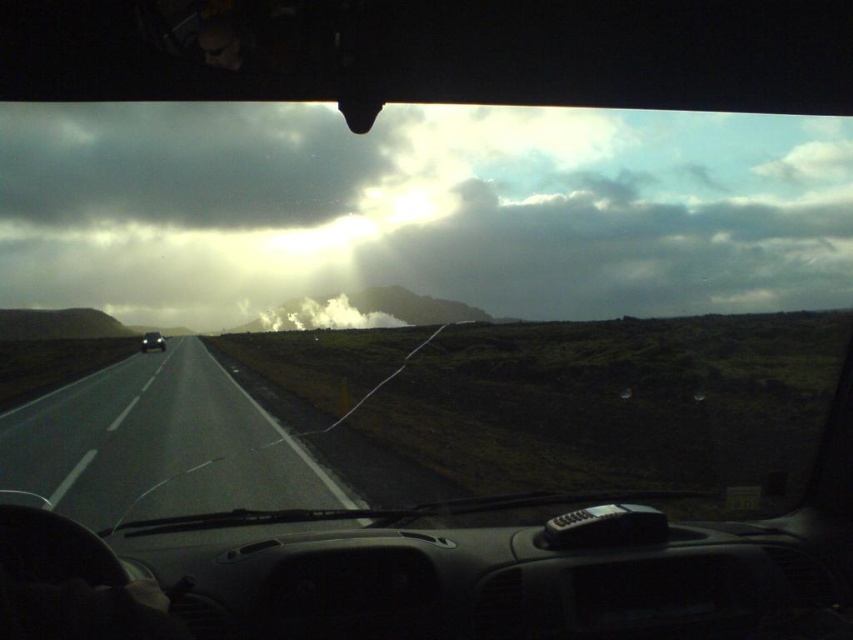
Question: Can you confirm if asphalt road at center is bigger than shiny black car at center?

Choices:
 (A) no
 (B) yes

Answer: (A)

Question: Which object is farther from the camera taking this photo?

Choices:
 (A) cloudy sky at upper center
 (B) shiny black car at center

Answer: (B)

Question: Is cloudy sky at upper center to the left of asphalt road at center from the viewer's perspective?

Choices:
 (A) no
 (B) yes

Answer: (A)

Question: Which point is farther from the camera taking this photo?

Choices:
 (A) (160, 339)
 (B) (190, 458)
 (C) (210, 168)

Answer: (C)

Question: Which is nearer to the cloudy sky at upper center?

Choices:
 (A) asphalt road at center
 (B) shiny black car at center

Answer: (B)

Question: Does asphalt road at center appear under shiny black car at center?

Choices:
 (A) no
 (B) yes

Answer: (B)